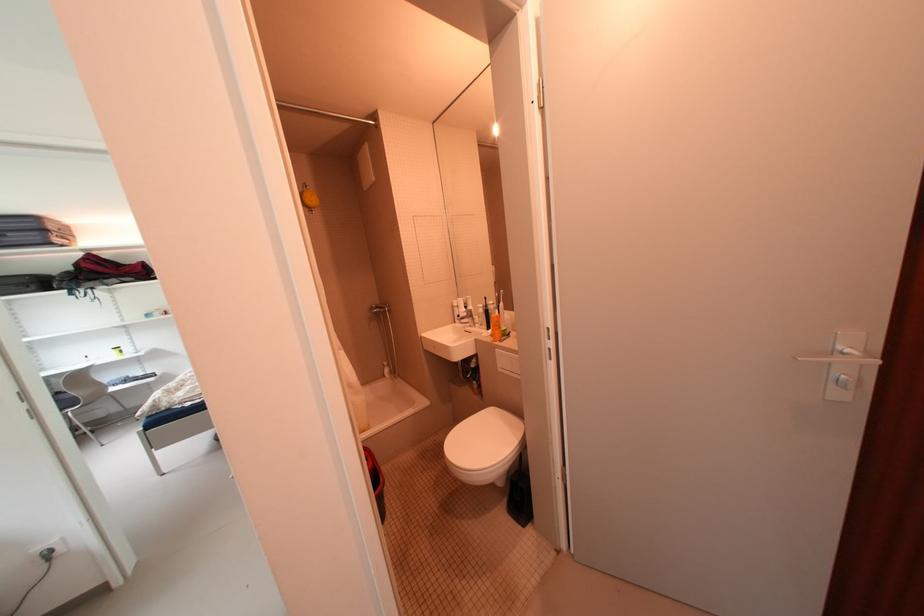
Identify the location of metal shower rod. pyautogui.click(x=324, y=113).